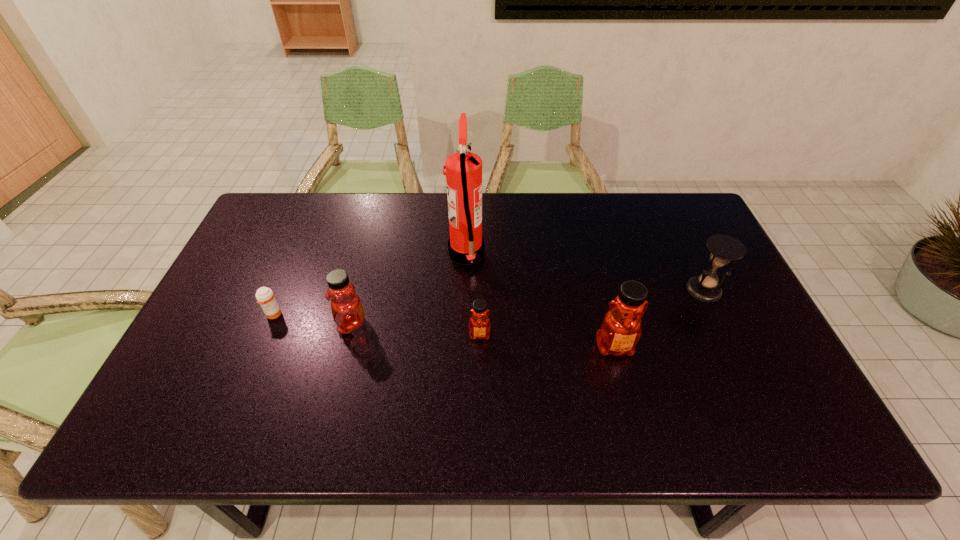
Identify the location of blank space at the near edge of the desktop. Image resolution: width=960 pixels, height=540 pixels. (379, 380).

Find the location of a particular element. The image size is (960, 540). vacant area at the left edge is located at coordinates (259, 287).

Locate an element on the screen. Image resolution: width=960 pixels, height=540 pixels. vacant space at the right edge of the desktop is located at coordinates (x=719, y=337).

This screenshot has width=960, height=540. In the image, there is a desktop. Find the location of `vacant space at the near right corner`. vacant space at the near right corner is located at coordinates (786, 379).

Identify the location of vacant area that lies between the second shortest honey and the rightmost object. The width and height of the screenshot is (960, 540). (527, 307).

You are a GUI agent. You are given a task and a screenshot of the screen. Output one action in this format:
    pyautogui.click(x=<x>, y=<y>)
    Task: Click on the vacant space in between the second object from right to left and the second honey from right to left
    
    Given the screenshot: What is the action you would take?
    pos(547,341)

Image resolution: width=960 pixels, height=540 pixels. I want to click on vacant space in between the shortest honey and the rightmost honey, so click(547, 341).

Identify the location of empty space between the tallest object and the medicine. (370, 284).

The height and width of the screenshot is (540, 960). I want to click on vacant point located between the tallest object and the rightmost honey, so click(x=540, y=300).

The width and height of the screenshot is (960, 540). Identify the location of vacant area that lies between the rightmost object and the fifth object from left to right. (660, 318).